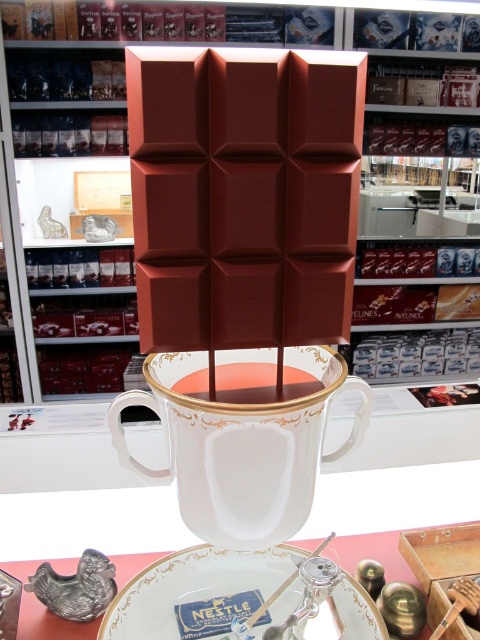
You are a customer at the chocolate shop and want to place a small chocolate truffle between the two points marked as point [223,432] and point 0.325, 0.535. Can you fit the truffle there without overlapping either point?

The two points are 19.27 inches apart, so yes, the truffle can be placed between them without overlapping either point as there is sufficient space.

You are a customer at the chocolate shop and want to place both the white porcelain cup at center and the white porcelain plate at center on a small shelf. Based on their sizes, which one should you place first to ensure both fit?

The white porcelain cup at center occupies less space than the white porcelain plate at center, so you should place the white porcelain plate at center first to leave enough room for the cup.

You are standing in the chocolate shop and want to place a small chocolate truffle on the display table. The truffle must be placed exactly between the two points labeled point [289,358] and point [385,561]. Which point is closer to the front of the display where customers can easily see it?

Point [289,358] is closer to the viewer than point [385,561], so placing the truffle between them would have the closer point facing forward for better visibility.